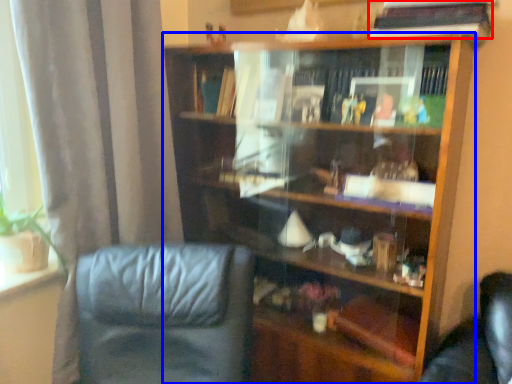
Question: Which object appears closest to the camera in this image, book (highlighted by a red box) or bookcase (highlighted by a blue box)?

Choices:
 (A) book
 (B) bookcase

Answer: (B)